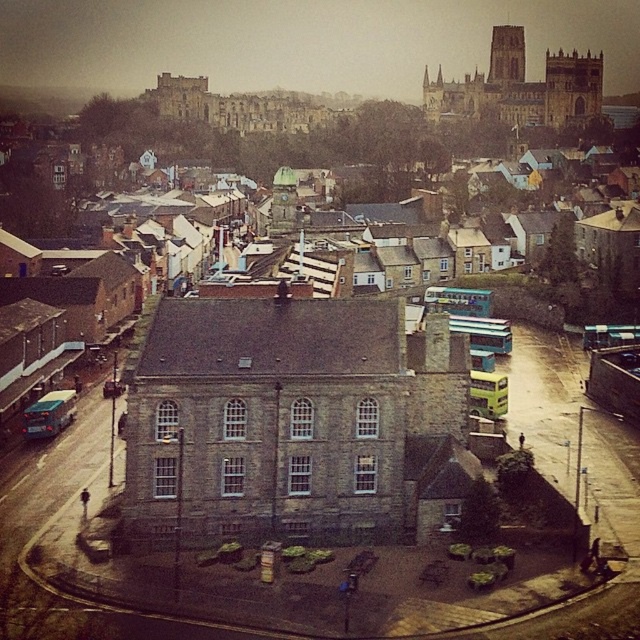
You are standing on a balcony overlooking the town. You notice the stone cathedral at upper right and the dark stone tower at upper center. Which of these two structures is positioned higher up in the image?

The dark stone tower at upper center is positioned higher up in the image than the stone cathedral at upper right.

In the scene shown: You are standing at the balcony overlooking the town and see the dark stone tower at upper right and the dark stone tower at upper center. Which one is located to the right of the other?

The dark stone tower at upper right is positioned on the right side of dark stone tower at upper center.